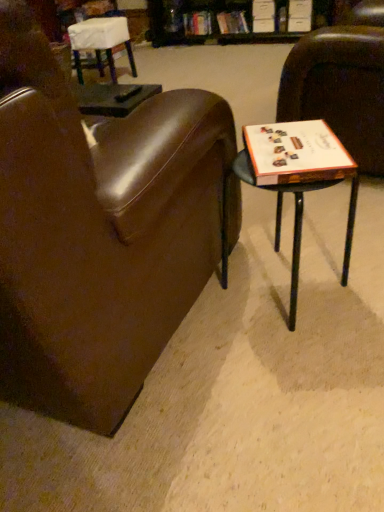
Locate an element on the screen. The image size is (384, 512). vacant region under white paper at right (from a real-world perspective) is located at coordinates (283, 144).